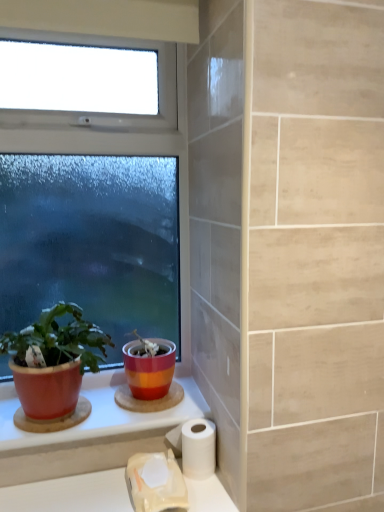
Question: Would you consider matte red pot at left to be distant from white matte toilet paper at lower center, acting as the 2th toilet paper starting from the right?

Choices:
 (A) yes
 (B) no

Answer: (B)

Question: From a real-world perspective, is matte red pot at left located beneath white matte toilet paper at lower center, acting as the 2th toilet paper starting from the right?

Choices:
 (A) no
 (B) yes

Answer: (A)

Question: From the image's perspective, is matte red pot at left on top of white matte toilet paper at lower center, which ranks as the 1th toilet paper in left-to-right order?

Choices:
 (A) yes
 (B) no

Answer: (A)

Question: Is matte red pot at left not inside white matte toilet paper at lower center, which ranks as the 1th toilet paper in left-to-right order?

Choices:
 (A) no
 (B) yes

Answer: (B)

Question: Does matte red pot at left have a larger size compared to white matte toilet paper at lower center, acting as the 2th toilet paper starting from the right?

Choices:
 (A) yes
 (B) no

Answer: (A)

Question: Is matte red pot at left smaller than white matte toilet paper at lower center, which ranks as the 1th toilet paper in left-to-right order?

Choices:
 (A) yes
 (B) no

Answer: (B)

Question: Is clear glass window at upper left outside matte ceramic pot at center?

Choices:
 (A) yes
 (B) no

Answer: (A)

Question: Is clear glass window at upper left wider than matte ceramic pot at center?

Choices:
 (A) no
 (B) yes

Answer: (A)

Question: Considering the relative positions of clear glass window at upper left and matte ceramic pot at center in the image provided, is clear glass window at upper left to the right of matte ceramic pot at center from the viewer's perspective?

Choices:
 (A) no
 (B) yes

Answer: (A)

Question: Does clear glass window at upper left lie behind matte ceramic pot at center?

Choices:
 (A) no
 (B) yes

Answer: (A)

Question: Is clear glass window at upper left closer to camera compared to matte ceramic pot at center?

Choices:
 (A) no
 (B) yes

Answer: (B)

Question: Is clear glass window at upper left beside matte ceramic pot at center?

Choices:
 (A) yes
 (B) no

Answer: (B)

Question: Considering the relative sizes of matte red pot at left and white matte toilet paper at lower center, arranged as the 2th toilet paper when viewed from the left, in the image provided, is matte red pot at left taller than white matte toilet paper at lower center, arranged as the 2th toilet paper when viewed from the left,?

Choices:
 (A) no
 (B) yes

Answer: (B)